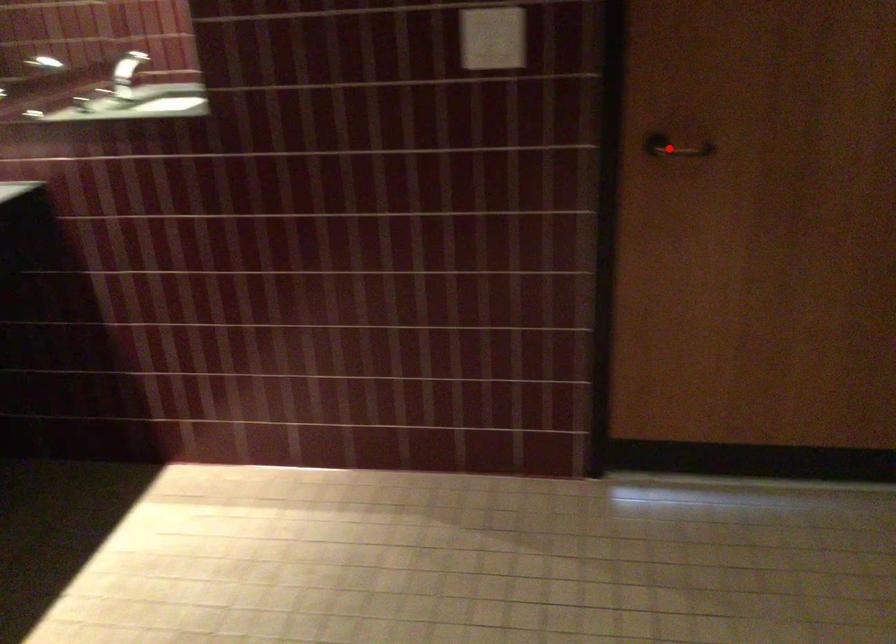
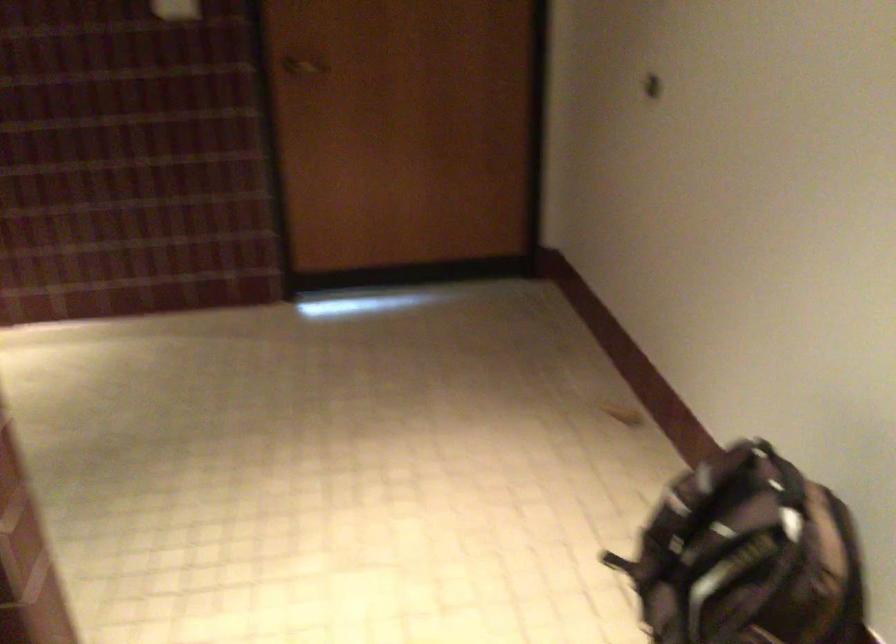
Locate, in the second image, the point that corresponds to the highlighted location in the first image.

(304, 66)